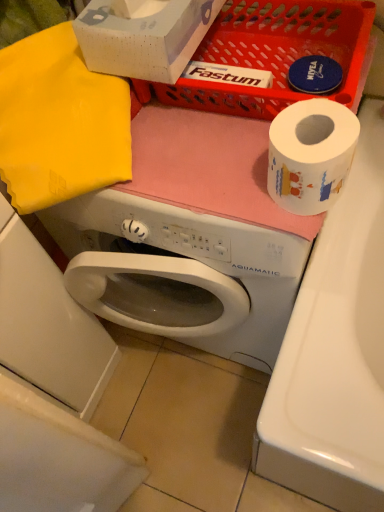
I want to click on vacant area on the back side of white matte toilet paper at upper right, so click(x=242, y=123).